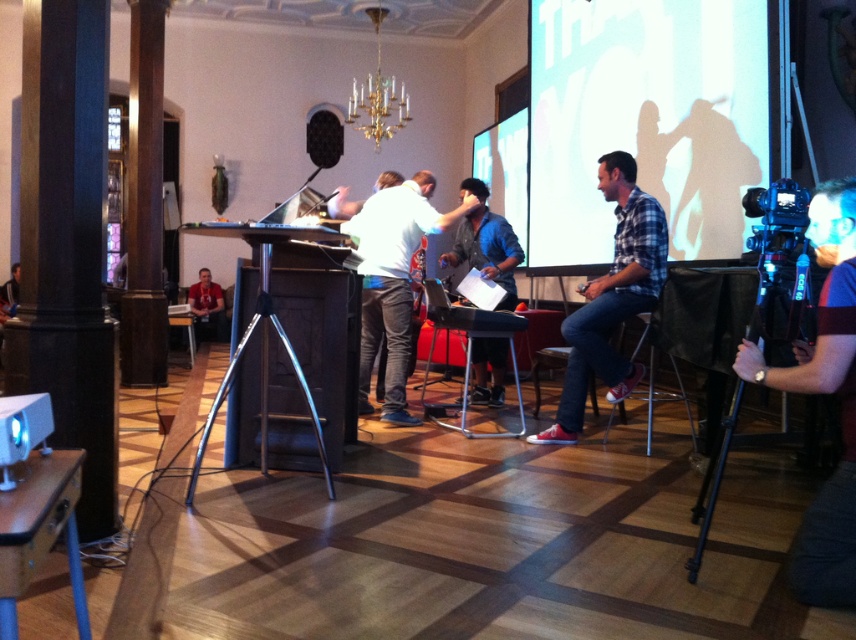
Question: Is blue fabric camera at right to the right of plaid cotton shirt at right from the viewer's perspective?

Choices:
 (A) yes
 (B) no

Answer: (A)

Question: Estimate the real-world distances between objects in this image. Which object is farther from the denim shirt at center?

Choices:
 (A) dark blue jeans at center
 (B) plaid cotton shirt at right

Answer: (A)

Question: Can you confirm if denim shirt at center is bigger than black matte speaker at center?

Choices:
 (A) no
 (B) yes

Answer: (B)

Question: Among these points, which one is farthest from the camera?

Choices:
 (A) (397, 243)
 (B) (637, 257)

Answer: (A)

Question: Among these points, which one is nearest to the camera?

Choices:
 (A) pos(325,120)
 (B) pos(845,284)

Answer: (B)

Question: Considering the relative positions of blue fabric camera at right and denim shirt at center in the image provided, where is blue fabric camera at right located with respect to denim shirt at center?

Choices:
 (A) above
 (B) below

Answer: (B)